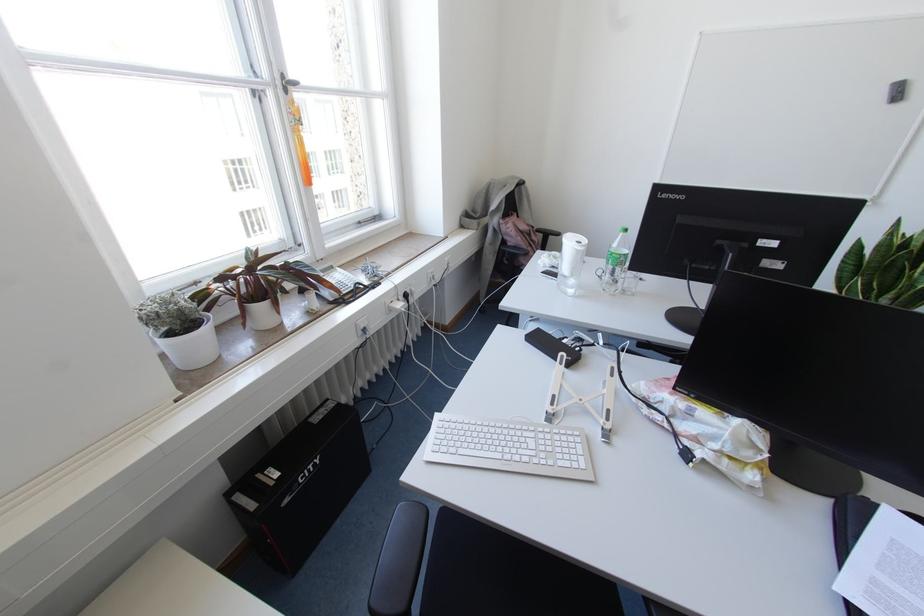
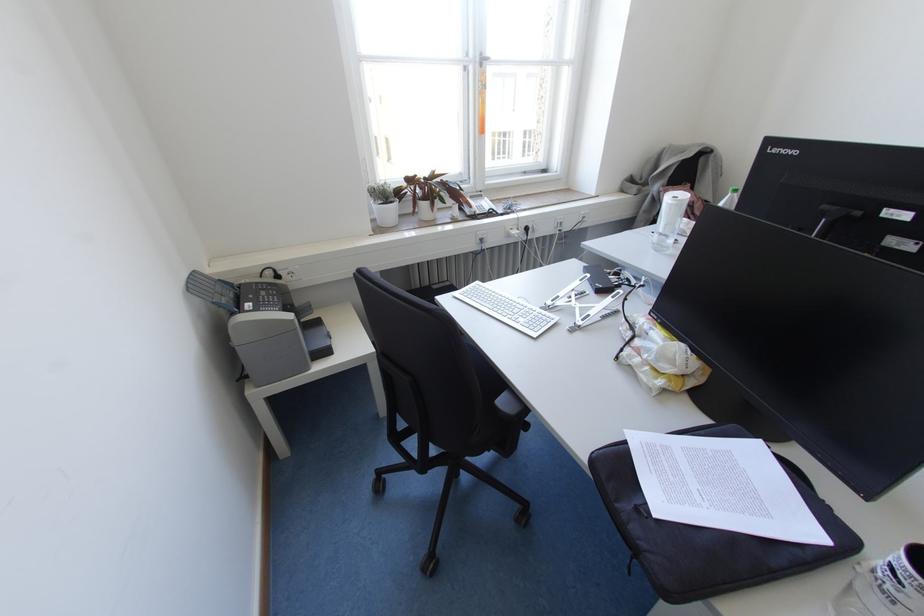
In the second image, find the point that corresponds to point 285,90 in the first image.

(480, 65)